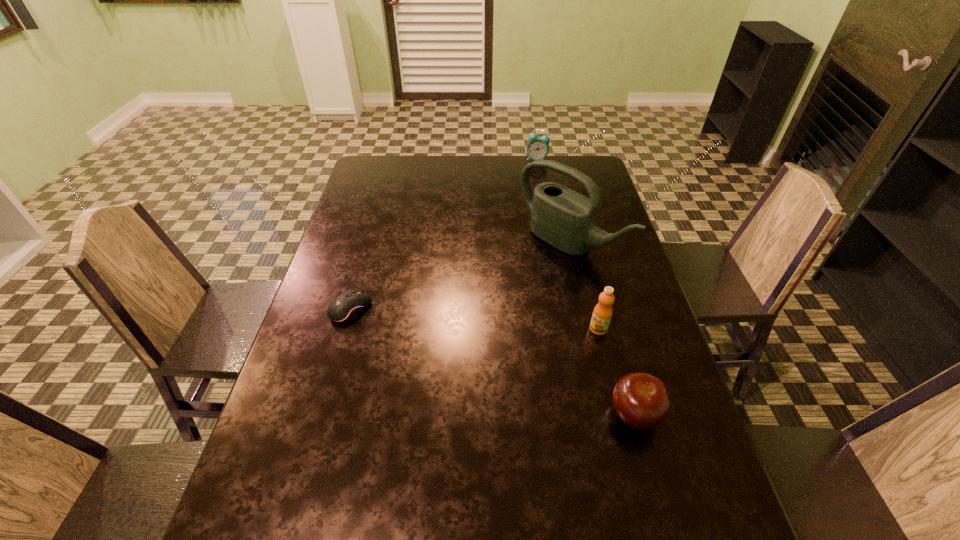
Find the location of `vacant space on the desktop that is between the leftmost object and the apple and is positioned on the face of the alarm clock`. vacant space on the desktop that is between the leftmost object and the apple and is positioned on the face of the alarm clock is located at coordinates (494, 362).

Where is `free space on the desktop that is between the computer mouse and the nearest object and is positioned on the spout of the tallest object`? free space on the desktop that is between the computer mouse and the nearest object and is positioned on the spout of the tallest object is located at coordinates [438, 341].

I want to click on free space on the desktop that is between the computer mouse and the nearest object and is positioned on the front label of the orange juice, so click(513, 369).